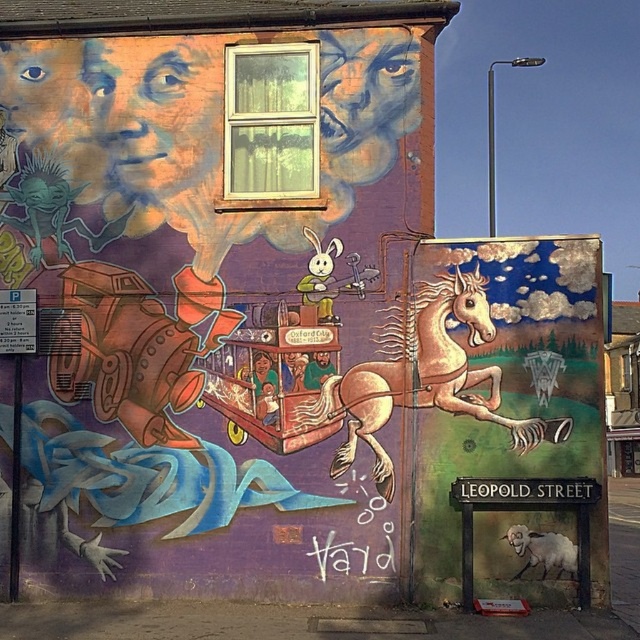
Question: Is the position of pastel pink paper horse at center more distant than that of black metal streetlight at upper right?

Choices:
 (A) no
 (B) yes

Answer: (A)

Question: Is pastel pink paper horse at center above black metal streetlight at upper right?

Choices:
 (A) no
 (B) yes

Answer: (A)

Question: Which of the following is the farthest from the observer?

Choices:
 (A) black metal streetlight at upper right
 (B) pastel pink paper horse at center

Answer: (A)

Question: Is pastel pink paper horse at center to the left of black metal streetlight at upper right from the viewer's perspective?

Choices:
 (A) no
 (B) yes

Answer: (B)